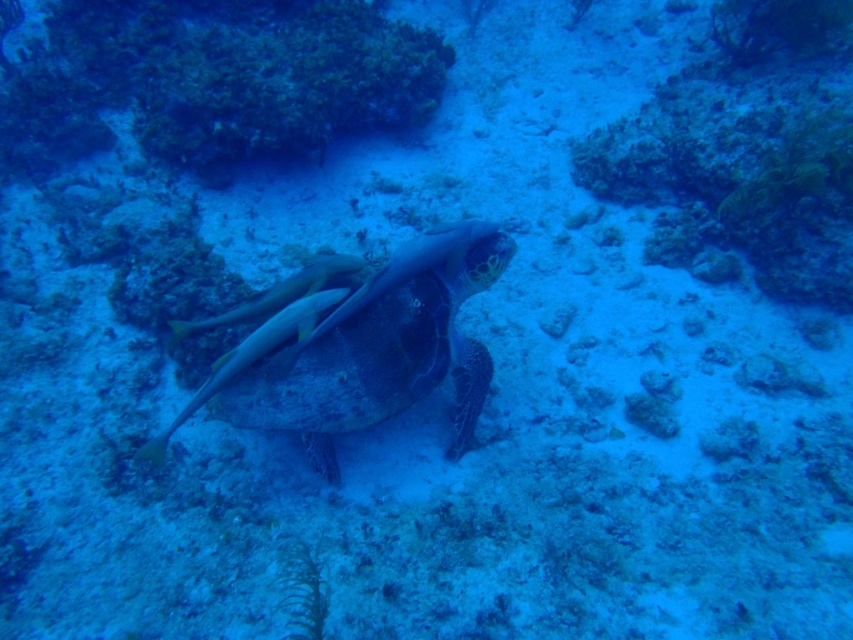
You are a marine biologist diving at a depth where your visibility is limited to 5 feet. You spot the green textured shell at center. Can you clearly see it from your current position?

The green textured shell at center is 6.00 feet away from the viewer, which exceeds the 5 feet visibility limit. Therefore, you cannot clearly see it from your current position.